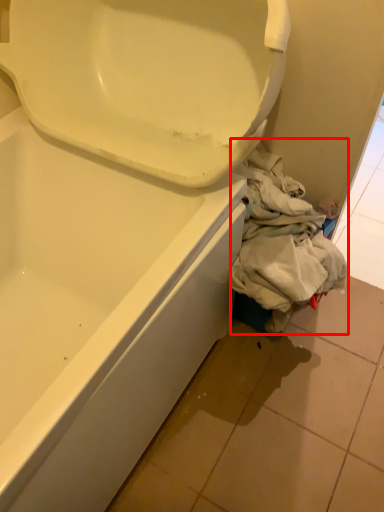
Question: From the image's perspective, where is clothing (annotated by the red box) located in relation to tile in the image?

Choices:
 (A) above
 (B) below

Answer: (A)